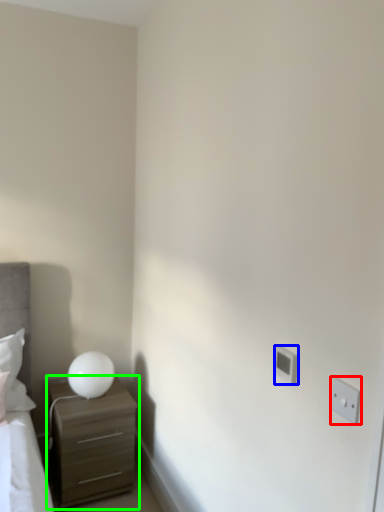
Question: Which object is the closest to the electric outlet (highlighted by a red box)? Choose among these: electric outlet (highlighted by a blue box) or chest of drawers (highlighted by a green box).

Choices:
 (A) electric outlet
 (B) chest of drawers

Answer: (A)